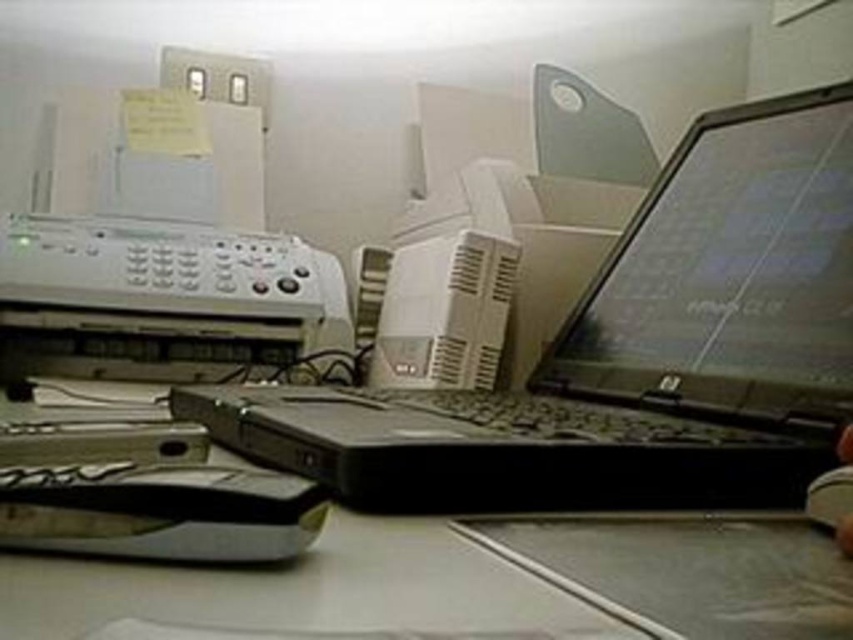
Is white plastic printer at upper left bigger than black plastic computer desk at center?

Yes.

This screenshot has width=853, height=640. In order to click on white plastic printer at upper left in this screenshot , I will do `click(160, 250)`.

Can you confirm if black plastic computer desk at center is wider than black plastic mouse at lower right?

Yes.

This screenshot has height=640, width=853. Describe the element at coordinates (343, 588) in the screenshot. I see `black plastic computer desk at center` at that location.

At what (x,y) coordinates should I click in order to perform the action: click on black plastic computer desk at center. Please return your answer as a coordinate pair (x, y). Image resolution: width=853 pixels, height=640 pixels. Looking at the image, I should click on (343, 588).

Is black plastic laptop at center to the left of white plastic printer at center from the viewer's perspective?

Incorrect, black plastic laptop at center is not on the left side of white plastic printer at center.

Which is behind, point (535, 456) or point (462, 273)?

Point (462, 273)

Who is more distant from viewer, (804, 397) or (538, 328)?

The point (538, 328) is more distant.

Identify the location of black plastic laptop at center. (628, 353).